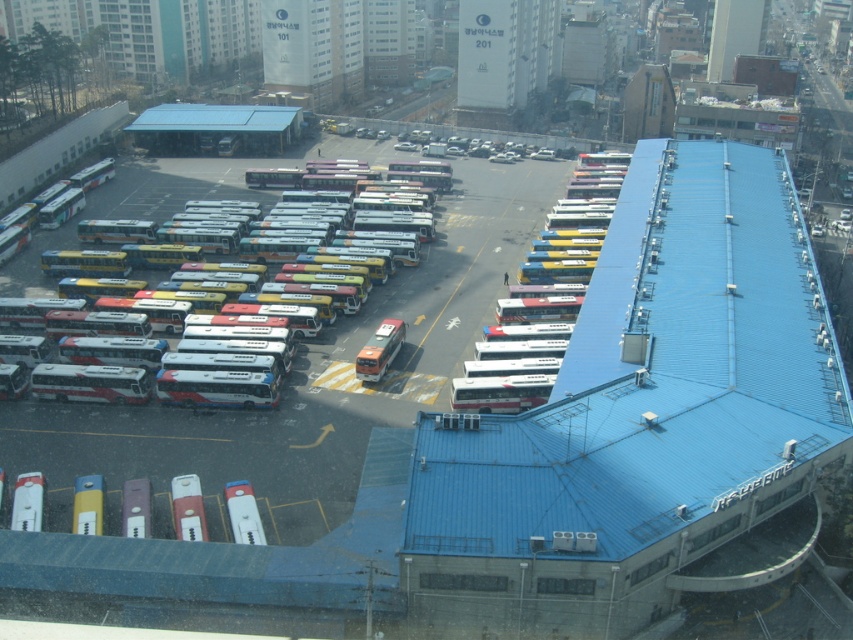
Question: Which of these objects is positioned farthest from the white glossy bus at lower left?

Choices:
 (A) white glossy bus at center-right
 (B) white matte bus at left
 (C) metallic silver bus at lower left

Answer: (B)

Question: Can you confirm if white glossy bus at center is wider than white glossy bus at lower left?

Choices:
 (A) no
 (B) yes

Answer: (B)

Question: Which point is closer to the camera?

Choices:
 (A) (187, 506)
 (B) (239, 531)
 (C) (509, 404)

Answer: (B)

Question: In this image, where is white matte bus at left located relative to white glossy bus at center?

Choices:
 (A) below
 (B) above

Answer: (B)

Question: Can you confirm if white matte bus at left is positioned above metallic silver bus at lower left?

Choices:
 (A) no
 (B) yes

Answer: (B)

Question: Considering the real-world distances, which object is closest to the white glossy bus at lower left?

Choices:
 (A) metallic silver bus at lower left
 (B) white matte bus at left
 (C) white glossy bus at center-right

Answer: (A)